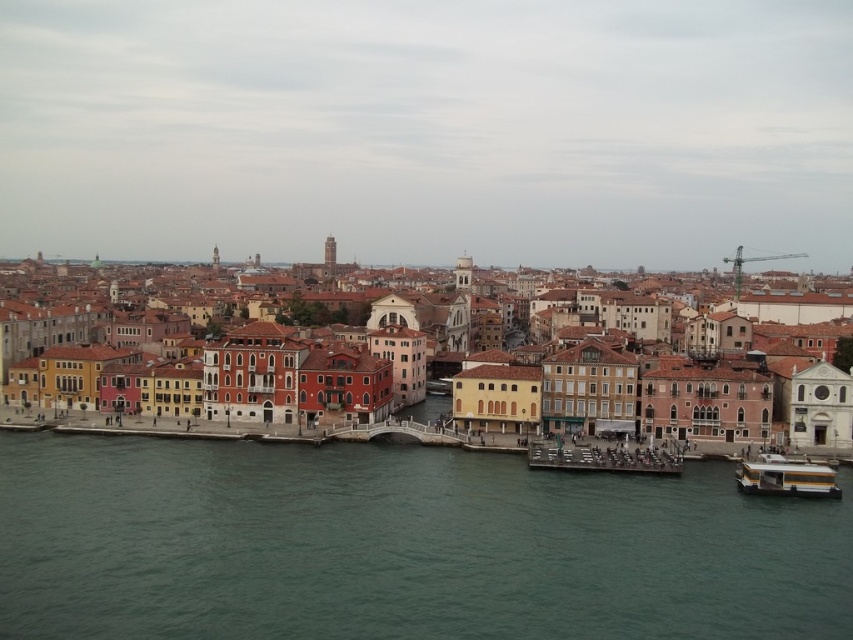
Question: Which of the following is the closest to the observer?

Choices:
 (A) greenish water at lower center
 (B) wooden dock at center
 (C) matte orange building at center
 (D) white glossy boat at lower right

Answer: (A)

Question: Based on their relative distances, which object is farther from the white glossy boat at lower right?

Choices:
 (A) greenish water at lower center
 (B) matte orange building at center

Answer: (B)

Question: Observing the image, what is the correct spatial positioning of greenish water at lower center in reference to white glossy boat at lower right?

Choices:
 (A) right
 (B) left

Answer: (B)

Question: Observing the image, what is the correct spatial positioning of greenish water at lower center in reference to white glossy boat at lower right?

Choices:
 (A) left
 (B) right

Answer: (A)

Question: In this image, where is matte orange building at center located relative to white glossy boat at lower right?

Choices:
 (A) below
 (B) above

Answer: (B)

Question: Among these points, which one is farthest from the camera?

Choices:
 (A) click(x=747, y=481)
 (B) click(x=16, y=397)
 (C) click(x=585, y=461)

Answer: (B)